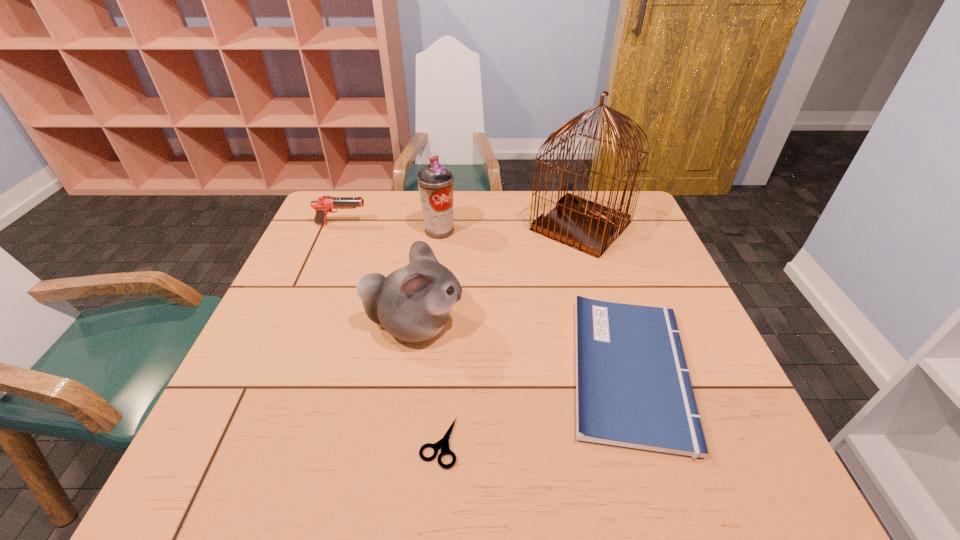
At what (x,y) coordinates should I click in order to perform the action: click on free location that satisfies the following two spatial constraints: 1. on the face of the third tallest object; 2. on the left side of the paperback book. Please return your answer as a coordinate pair (x, y). Looking at the image, I should click on (407, 370).

The height and width of the screenshot is (540, 960). What are the coordinates of `vacant space that satisfies the following two spatial constraints: 1. at the aiming end of the shears; 2. on the right side of the third shortest object` in the screenshot? It's located at (250, 442).

Find the location of a particular element. vacant region that satisfies the following two spatial constraints: 1. on the front side of the shortest object; 2. on the right side of the aerosol can is located at coordinates (414, 442).

Locate an element on the screen. The image size is (960, 540). free point that satisfies the following two spatial constraints: 1. at the aiming end of the leftmost object; 2. on the left side of the second tallest object is located at coordinates (339, 231).

At what (x,y) coordinates should I click in order to perform the action: click on free location that satisfies the following two spatial constraints: 1. at the aiming end of the gun; 2. on the right side of the tallest object. Please return your answer as a coordinate pair (x, y). Image resolution: width=960 pixels, height=540 pixels. Looking at the image, I should click on (341, 226).

Locate an element on the screen. Image resolution: width=960 pixels, height=540 pixels. vacant space that satisfies the following two spatial constraints: 1. at the aiming end of the shortest object; 2. on the right side of the gun is located at coordinates (250, 442).

Locate an element on the screen. Image resolution: width=960 pixels, height=540 pixels. blank space that satisfies the following two spatial constraints: 1. on the front side of the birdcage; 2. on the right side of the paperback book is located at coordinates (625, 370).

Image resolution: width=960 pixels, height=540 pixels. Identify the location of vacant space that satisfies the following two spatial constraints: 1. on the face of the hamster; 2. on the back side of the shears. (396, 442).

Locate an element on the screen. The height and width of the screenshot is (540, 960). vacant space that satisfies the following two spatial constraints: 1. at the aiming end of the third shortest object; 2. on the back side of the tallest object is located at coordinates (341, 226).